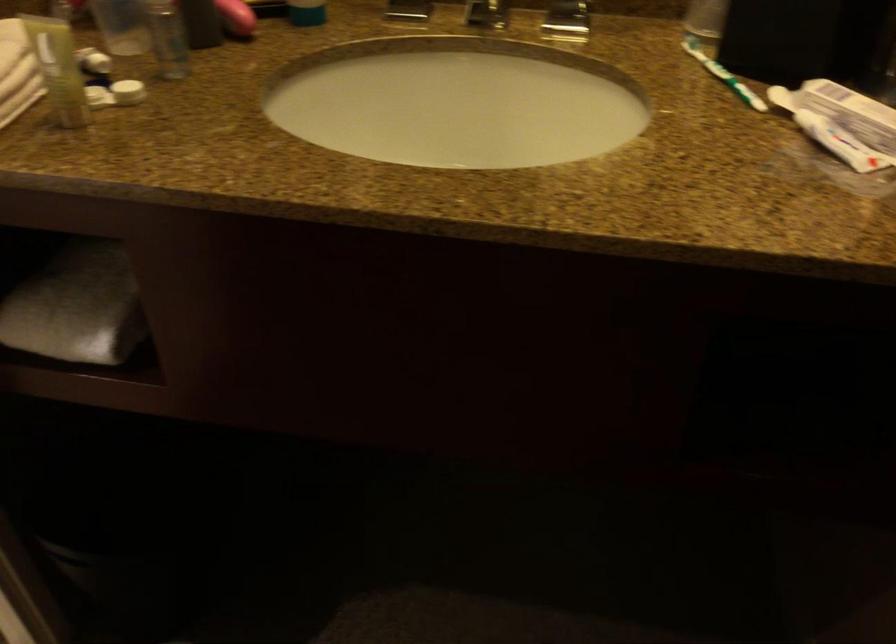
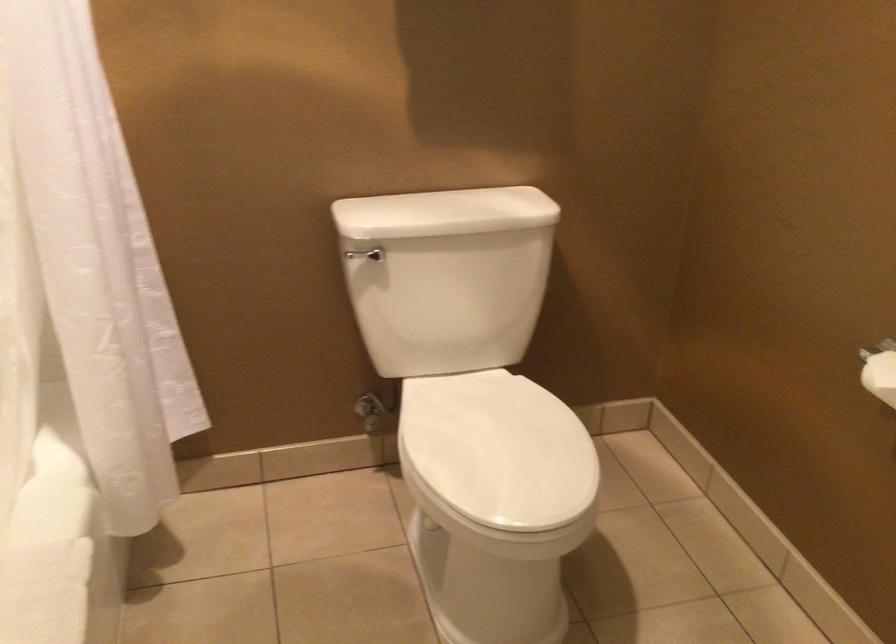
Question: The camera is either moving clockwise (left) or counter-clockwise (right) around the object. The first image is from the beginning of the video and the second image is from the end. Is the camera moving left or right when shooting the video?

Choices:
 (A) Left
 (B) Right

Answer: (B)